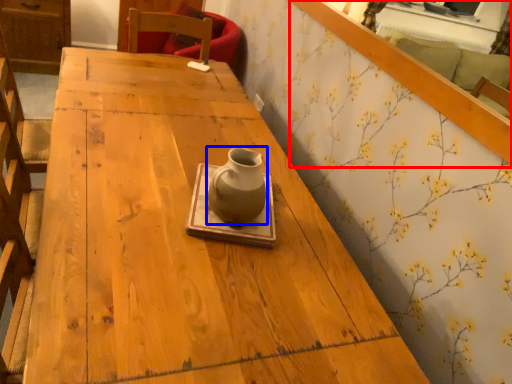
Question: Among these objects, which one is nearest to the camera, mirror (highlighted by a red box) or vase (highlighted by a blue box)?

Choices:
 (A) mirror
 (B) vase

Answer: (A)